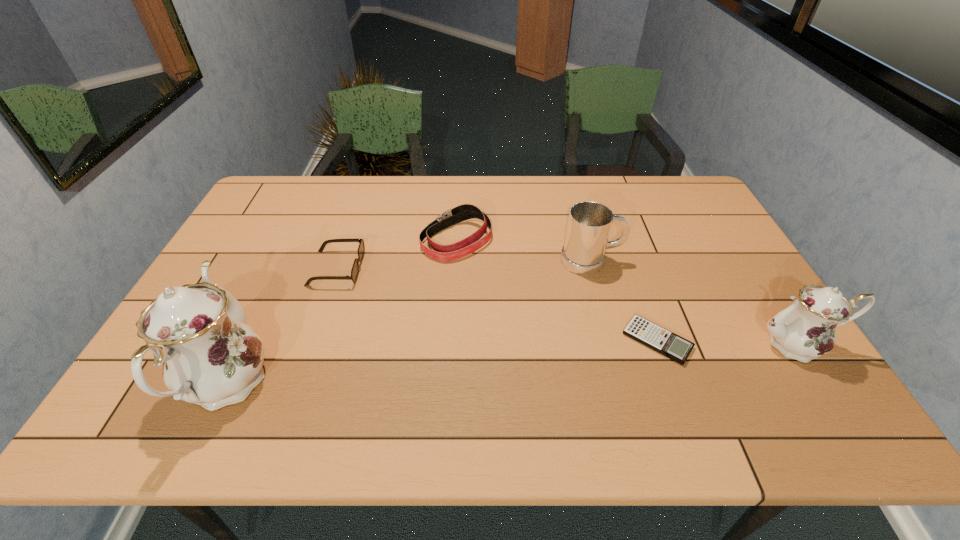
The image size is (960, 540). I want to click on vacant space that satisfies the following two spatial constraints: 1. on the side of the third tallest object with the handle; 2. on the back side of the shortest object, so click(612, 341).

Locate an element on the screen. The image size is (960, 540). free space that satisfies the following two spatial constraints: 1. on the side of the shortest object with the handle; 2. on the left side of the mug is located at coordinates (612, 341).

You are a GUI agent. You are given a task and a screenshot of the screen. Output one action in this format:
    pyautogui.click(x=<x>, y=<y>)
    Task: Click on the free space in the image that satisfies the following two spatial constraints: 1. on the back side of the taller chinaware; 2. on the right side of the shortest object
    
    Given the screenshot: What is the action you would take?
    pyautogui.click(x=246, y=341)

Find the location of a particular element. vacant space that satisfies the following two spatial constraints: 1. on the front-facing side of the second shortest object; 2. on the right side of the calculator is located at coordinates (312, 341).

I want to click on vacant area that satisfies the following two spatial constraints: 1. on the side of the shortest object with the handle; 2. on the right side of the fourth shortest object, so coord(612,341).